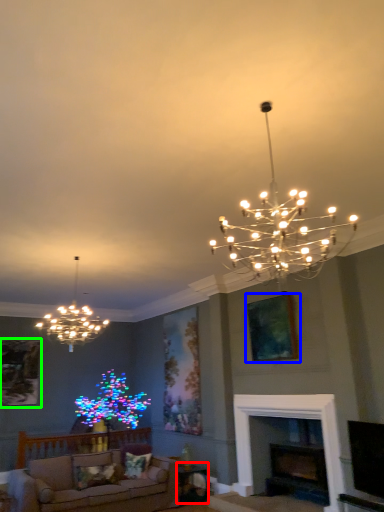
Question: Which object is positioned farthest from table (highlighted by a red box)? Select from picture frame (highlighted by a blue box) and picture frame (highlighted by a green box).

Choices:
 (A) picture frame
 (B) picture frame

Answer: (B)